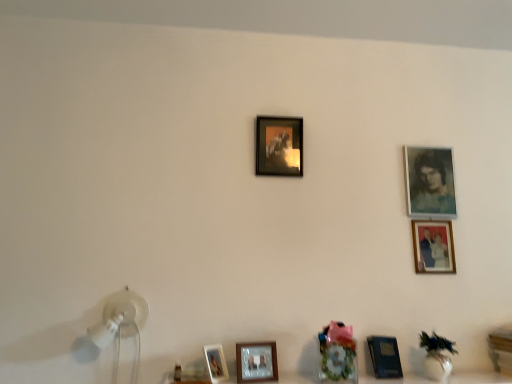
Question: Is point (420, 200) closer or farther from the camera than point (265, 173)?

Choices:
 (A) closer
 (B) farther

Answer: (B)

Question: Based on their positions, is blue textured portrait at upper right, acting as the fifth picture frame starting from the bottom, located to the left or right of matte black picture frame at center, the 4th picture frame positioned from the right?

Choices:
 (A) left
 (B) right

Answer: (B)

Question: Which object is positioned farthest from the matte glass photo frame at lower center, which appears as the second picture frame when ordered from the bottom?

Choices:
 (A) white glossy table lamp at lower left
 (B) matte glass picture frame at lower right, marked as the third picture frame in a top-to-bottom arrangement
 (C) metallic blue picture frame at lower right, which is counted as the third picture frame, starting from the right
 (D) wooden table at lower right
 (E) matte black picture frame at center, the 4th picture frame positioned from the right

Answer: (D)

Question: Which is nearer to the matte glass picture frame at center, the 5th picture frame positioned from the right?

Choices:
 (A) wooden table at lower right
 (B) white glossy table lamp at lower left
 (C) blue textured portrait at upper right, the first picture frame when ordered from right to left
 (D) metallic blue picture frame at lower right, which is counted as the third picture frame, starting from the right
 (E) matte glass picture frame at lower right, the fourth picture frame in the bottom-to-top sequence

Answer: (D)